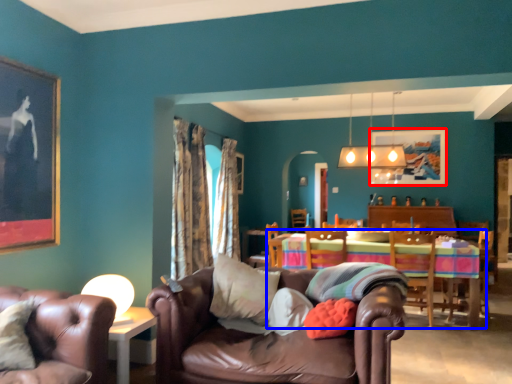
Question: Which of the following is the closest to the observer, picture frame (highlighted by a red box) or kitchen & dining room table (highlighted by a blue box)?

Choices:
 (A) picture frame
 (B) kitchen & dining room table

Answer: (B)